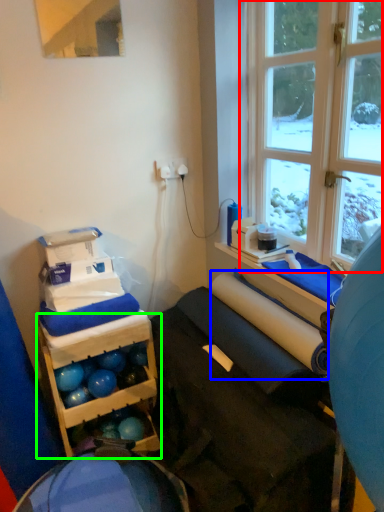
Question: Which object is positioned farthest from window (highlighted by a red box)? Select from paper towel (highlighted by a blue box) and shelf (highlighted by a green box).

Choices:
 (A) paper towel
 (B) shelf

Answer: (B)